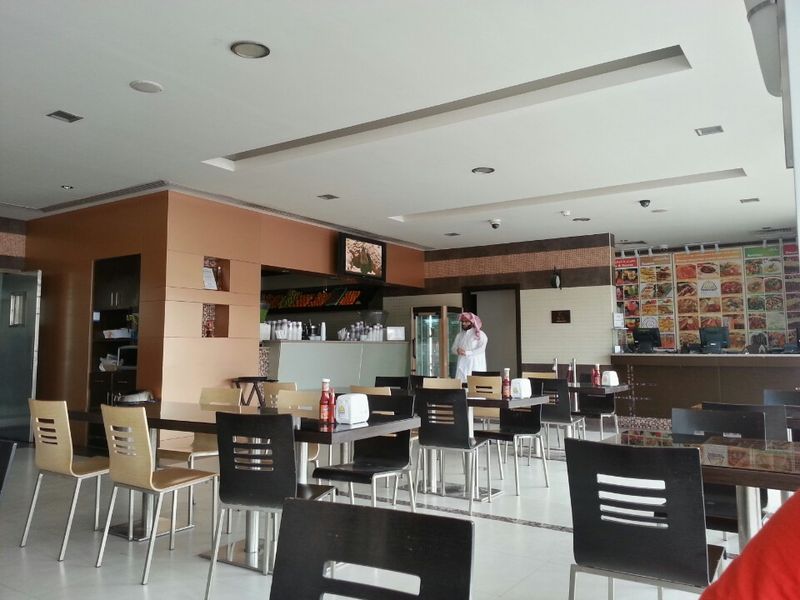
The width and height of the screenshot is (800, 600). I want to click on table, so click(780, 466), click(720, 450), click(177, 408), click(198, 414).